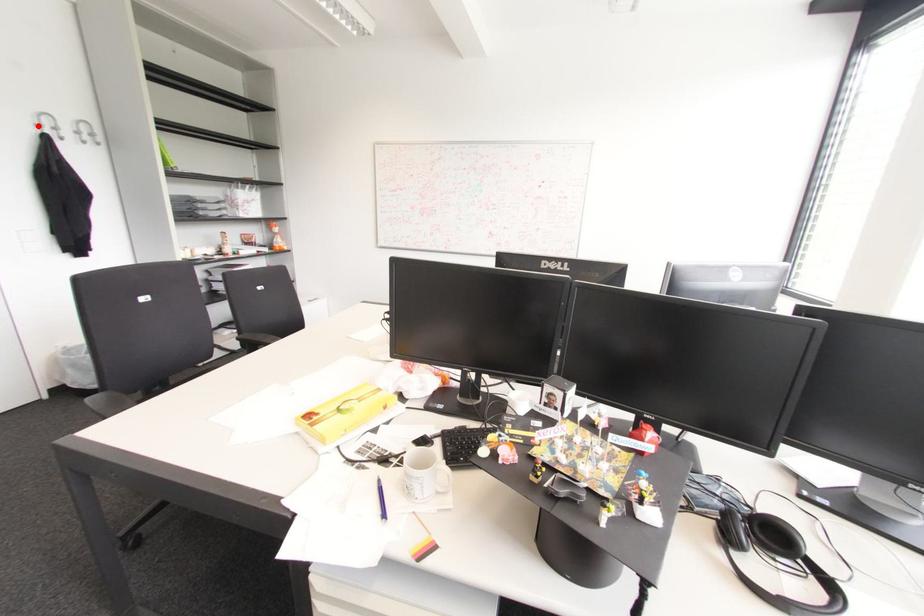
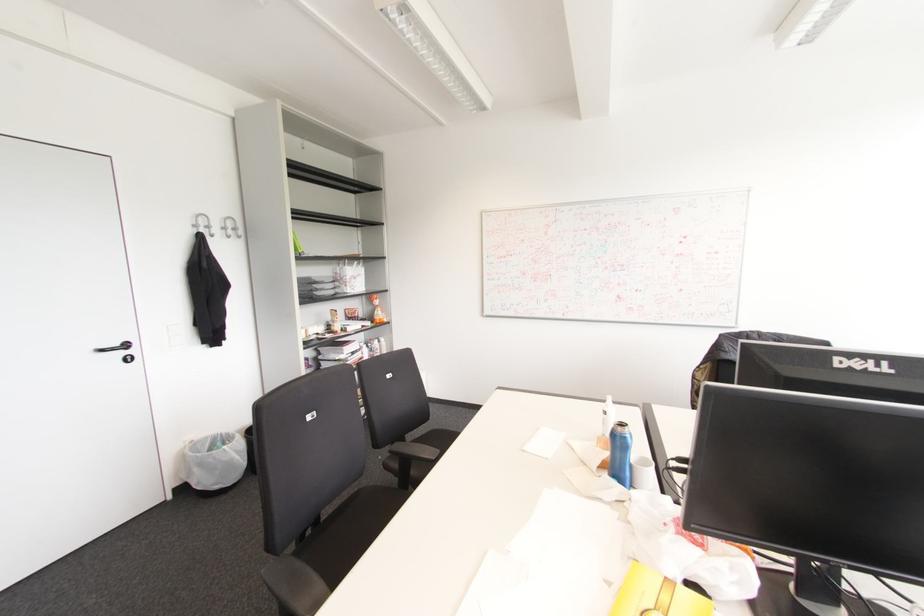
In the second image, find the point that corresponds to the highlighted location in the first image.

(195, 225)